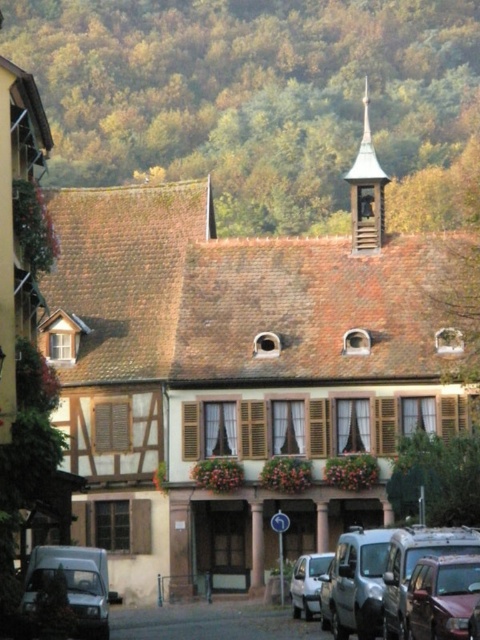
Question: Does silver metallic car at lower right appear on the right side of metallic silver van at lower left?

Choices:
 (A) no
 (B) yes

Answer: (B)

Question: Does metallic silver van at lower right come behind white matte car at lower center?

Choices:
 (A) no
 (B) yes

Answer: (A)

Question: Among these objects, which one is farthest from the camera?

Choices:
 (A) silver metallic car at lower right
 (B) green copper spire at upper center

Answer: (B)

Question: Among these points, which one is farthest from the camera?

Choices:
 (A) (381, 172)
 (B) (441, 586)
 (C) (420, 541)
 (D) (380, 529)

Answer: (A)

Question: Considering the real-world distances, which object is closest to the silver metallic car at lower right?

Choices:
 (A) metallic silver van at lower right
 (B) green copper spire at upper center
 (C) metallic silver car at lower right
 (D) white matte car at lower center

Answer: (A)

Question: Can you confirm if silver metallic car at lower right is positioned below green copper spire at upper center?

Choices:
 (A) no
 (B) yes

Answer: (B)